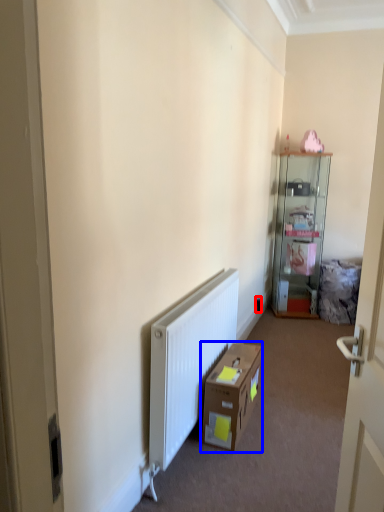
Question: Which object appears closest to the camera in this image, electric outlet (highlighted by a red box) or cardboard box (highlighted by a blue box)?

Choices:
 (A) electric outlet
 (B) cardboard box

Answer: (B)